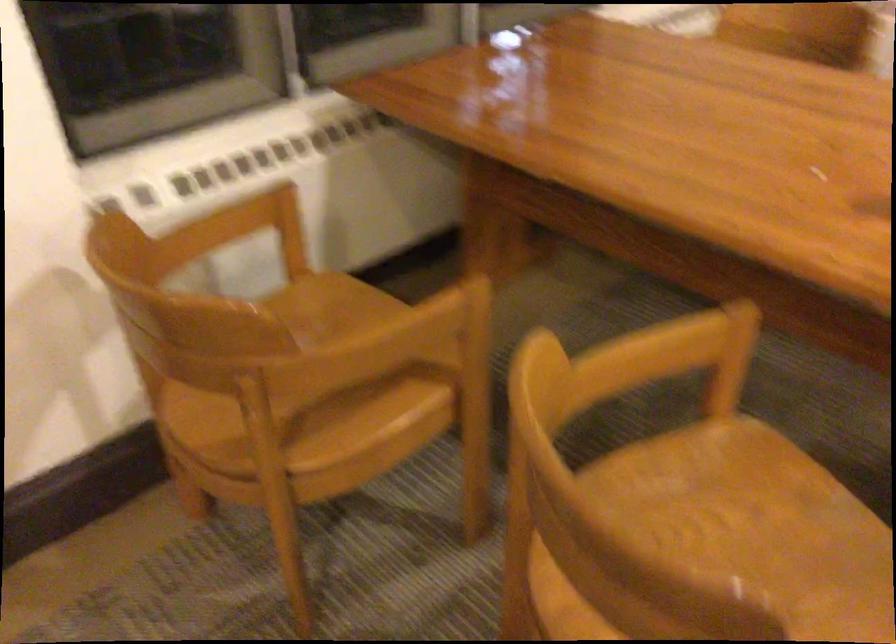
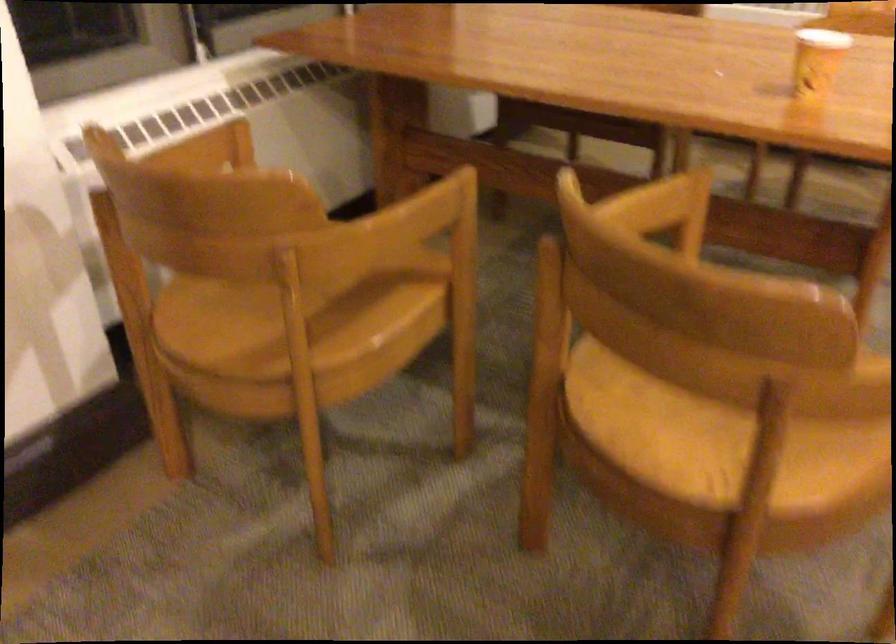
Question: Based on the continuous images, in which direction is the camera rotating? Reply with the corresponding letter.

Choices:
 (A) Left
 (B) Right
 (C) Up
 (D) Down

Answer: (B)